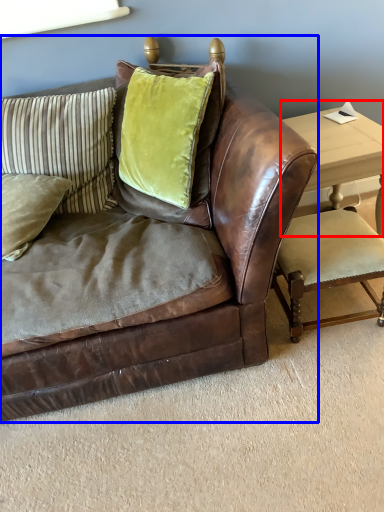
Question: Among these objects, which one is nearest to the camera, table (highlighted by a red box) or studio couch (highlighted by a blue box)?

Choices:
 (A) table
 (B) studio couch

Answer: (B)